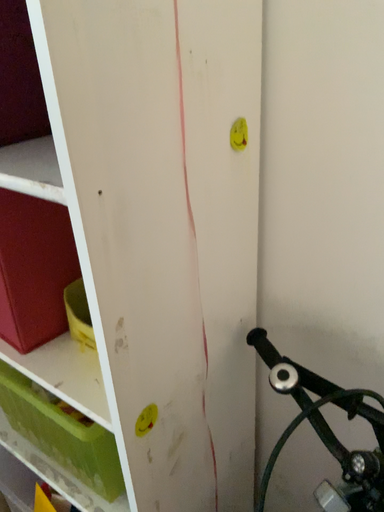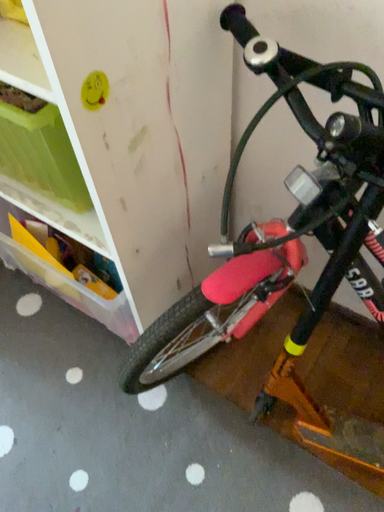
Question: Which way did the camera rotate in the video?

Choices:
 (A) rotated downward
 (B) rotated upward

Answer: (A)